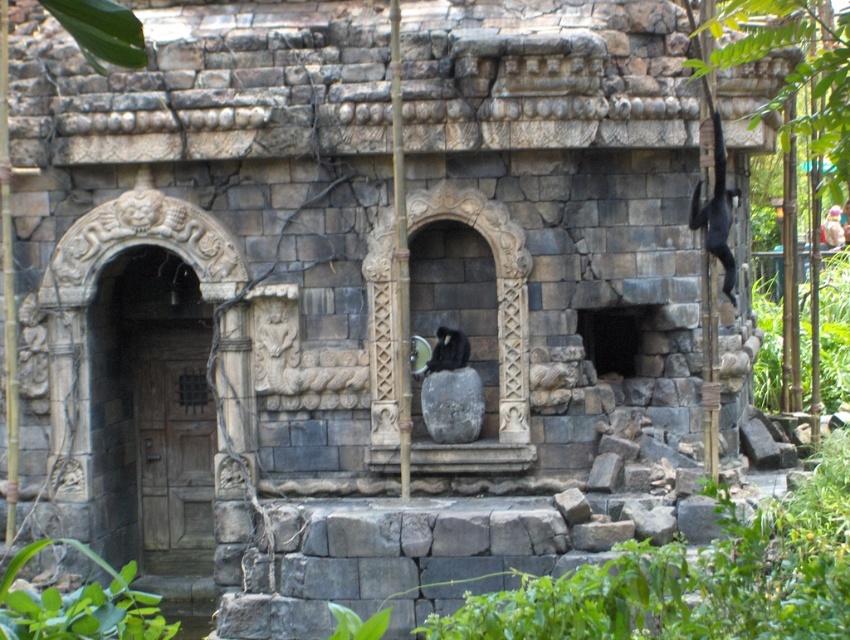
Does point (834, 157) come behind point (825, 307)?

No, (834, 157) is closer to viewer.

Between green leafy plant at upper right and green leafy plant at right, which one has less height?

green leafy plant at right is shorter.

This screenshot has height=640, width=850. Describe the element at coordinates (795, 68) in the screenshot. I see `green leafy plant at upper right` at that location.

The height and width of the screenshot is (640, 850). In order to click on green leafy plant at upper right in this screenshot , I will do `click(795, 68)`.

Does green leafy plant at upper right appear on the left side of green leafy plant at lower left?

Incorrect, green leafy plant at upper right is not on the left side of green leafy plant at lower left.

Is green leafy plant at upper right wider than green leafy plant at lower left?

Correct, the width of green leafy plant at upper right exceeds that of green leafy plant at lower left.

Does point (774, 29) come in front of point (77, 544)?

Yes.

Identify the location of green leafy plant at upper right. Image resolution: width=850 pixels, height=640 pixels. (795, 68).

Who is shorter, green leafy plant at lower left or green leafy plant at right?

Standing shorter between the two is green leafy plant at lower left.

Does green leafy plant at lower left have a smaller size compared to green leafy plant at right?

Incorrect, green leafy plant at lower left is not smaller in size than green leafy plant at right.

Which is behind, point (66, 540) or point (769, 339)?

Positioned behind is point (769, 339).

Locate an element on the screen. The height and width of the screenshot is (640, 850). green leafy plant at lower left is located at coordinates (78, 605).